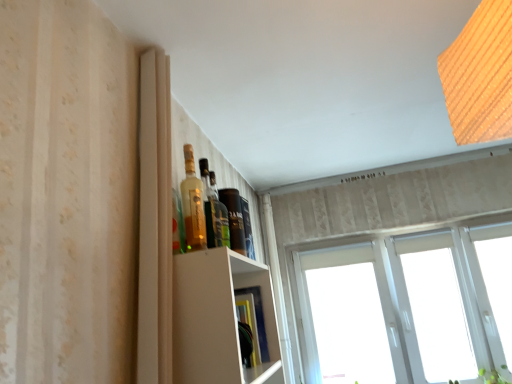
Question: Looking at the image, does white plastic window at upper right seem bigger or smaller compared to translucent glass bottle at upper center, which is the first bottle from back to front?

Choices:
 (A) big
 (B) small

Answer: (A)

Question: Considering the positions of point (487, 360) and point (205, 216), is point (487, 360) closer or farther from the camera than point (205, 216)?

Choices:
 (A) closer
 (B) farther

Answer: (B)

Question: Based on their relative distances, which object is farther from the white plastic window at upper right?

Choices:
 (A) translucent glass bottle at upper center, arranged as the second bottle when viewed from the front
 (B) translucent glass bottle at upper center, placed as the 2th bottle when sorted from back to front
 (C) green leafy plant at lower right
 (D) wooden textured light at upper right

Answer: (D)

Question: Which object is the farthest from the green leafy plant at lower right?

Choices:
 (A) translucent glass bottle at upper center, which is the 1th bottle from front to back
 (B) wooden textured light at upper right
 (C) translucent glass bottle at upper center, which is the first bottle from back to front
 (D) white plastic window at upper right

Answer: (B)